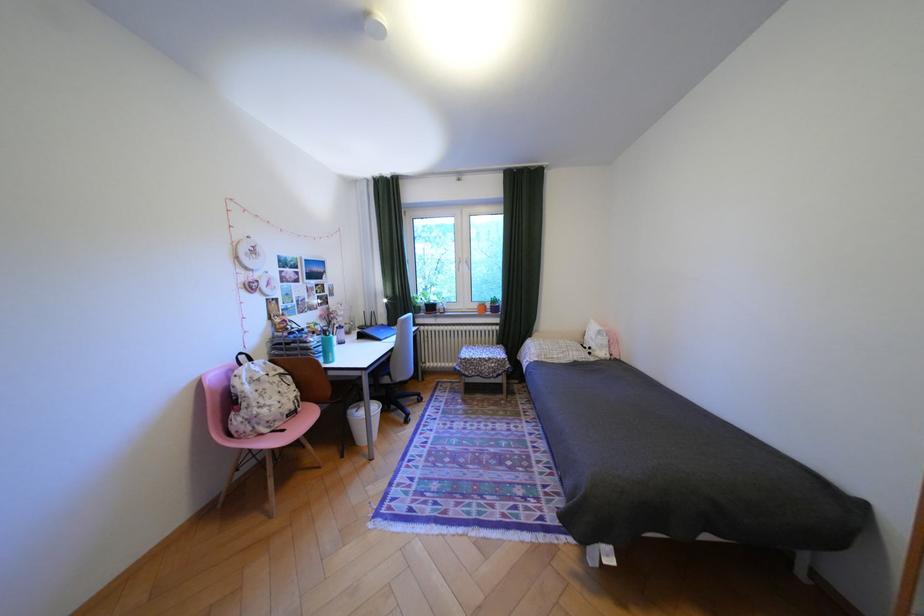
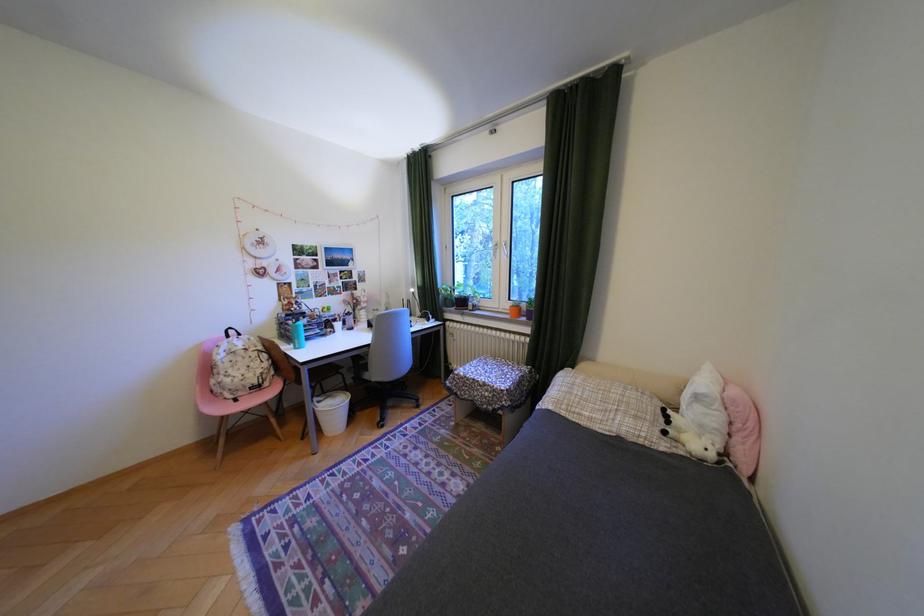
Where in the second image is the point corresponding to (479,373) from the first image?

(470, 392)